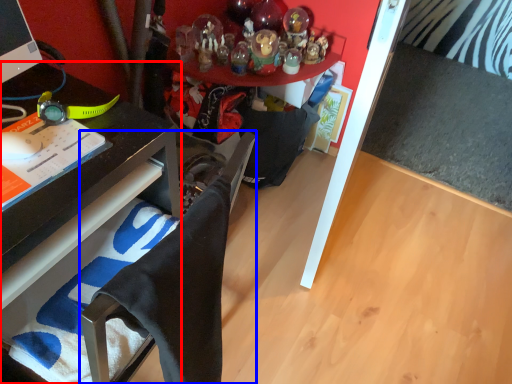
Question: Which object is further to the camera taking this photo, desk (highlighted by a red box) or computer chair (highlighted by a blue box)?

Choices:
 (A) desk
 (B) computer chair

Answer: (A)